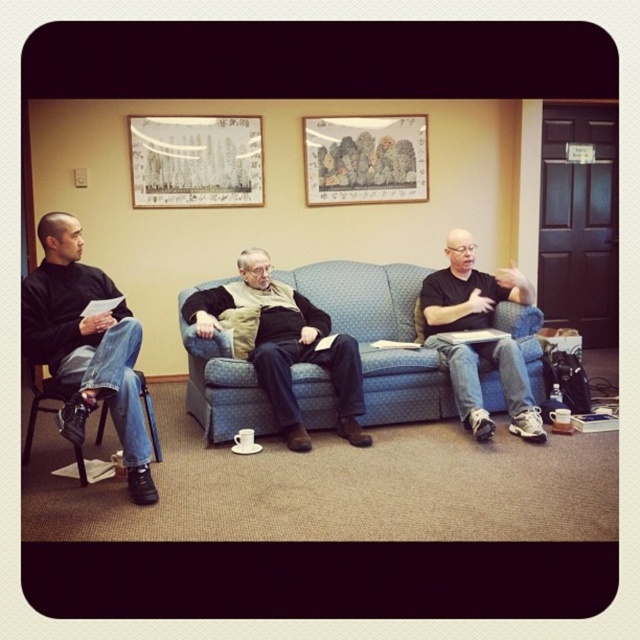
Question: Does black matte shirt at center appear under wooden framed picture at center?

Choices:
 (A) yes
 (B) no

Answer: (A)

Question: Which is farther from the matte paper picture frame at upper left?

Choices:
 (A) black matte jeans at left
 (B) wooden framed picture at center
 (C) black matte shirt at center
 (D) black plastic chair at left

Answer: (C)

Question: Which point is farther to the camera?

Choices:
 (A) (186, 304)
 (B) (189, 298)
 (C) (442, 323)
 (D) (164, 124)

Answer: (D)

Question: Which point is closer to the camera taking this photo?

Choices:
 (A) (147, 120)
 (B) (129, 483)
 (C) (506, 376)
 (D) (394, 129)

Answer: (B)

Question: Can you confirm if black matte jeans at left is thinner than matte black vest at center?

Choices:
 (A) yes
 (B) no

Answer: (A)

Question: Does black matte jeans at left come behind black plastic chair at left?

Choices:
 (A) yes
 (B) no

Answer: (B)